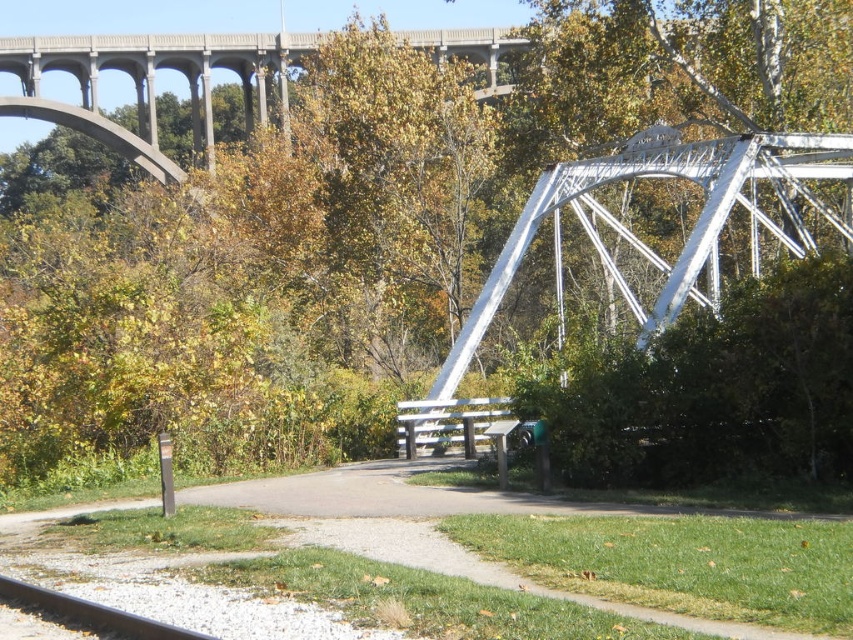
Question: Which object is farther from the camera taking this photo?

Choices:
 (A) gravel path at center
 (B) smooth steel rail at lower left
 (C) concrete bridge at upper center
 (D) wooden park bench at center

Answer: (C)

Question: Which is farther from the wooden park bench at center?

Choices:
 (A) smooth steel rail at lower left
 (B) concrete bridge at upper center

Answer: (B)

Question: Can you confirm if concrete bridge at upper center is positioned above smooth steel rail at lower left?

Choices:
 (A) no
 (B) yes

Answer: (B)

Question: Which point is farther from the camera taking this photo?

Choices:
 (A) (106, 630)
 (B) (35, 45)
 (C) (506, 448)

Answer: (B)

Question: Is white metallic bridge at center positioned in front of wooden park bench at center?

Choices:
 (A) yes
 (B) no

Answer: (B)

Question: Does gravel path at center come in front of smooth steel rail at lower left?

Choices:
 (A) yes
 (B) no

Answer: (A)